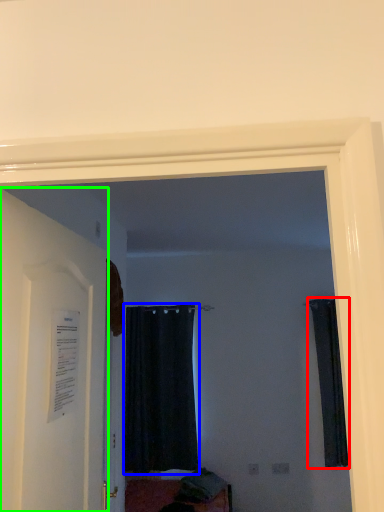
Question: Considering the real-world distances, which object is closest to curtain (highlighted by a red box)? curtain (highlighted by a blue box) or door (highlighted by a green box).

Choices:
 (A) curtain
 (B) door

Answer: (A)